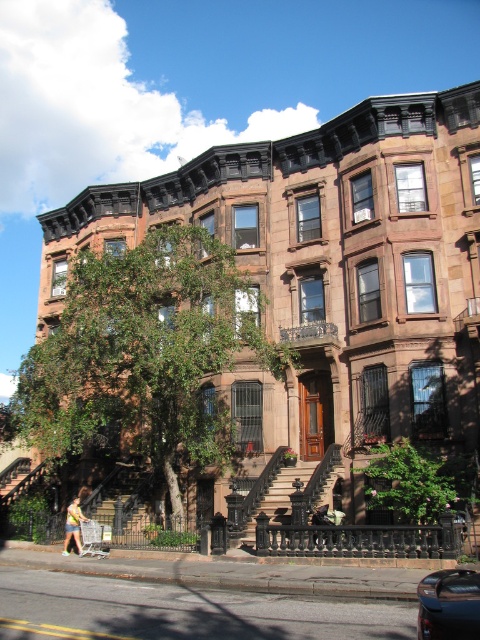
You are standing on the sidewalk in front of the brownstone buildings. You see the green leafy tree at left and the shiny black car at lower right. Which object is closer to you?

The green leafy tree at left is closer to you because it is further to the viewer than the shiny black car at lower right.

You are standing on the sidewalk in front of the brownstone buildings and notice the green leafy tree at left and the shiny black car at lower right. Which object takes up more space in the image?

The green leafy tree at left takes up more space in the image than the shiny black car at lower right because it is bigger.